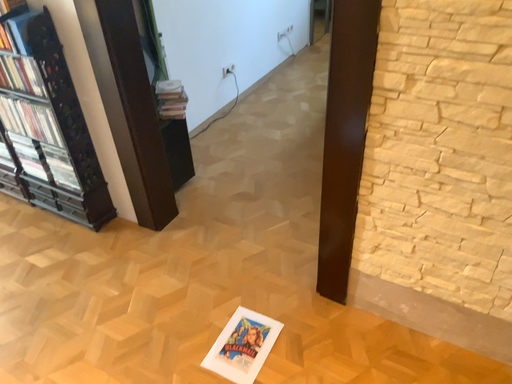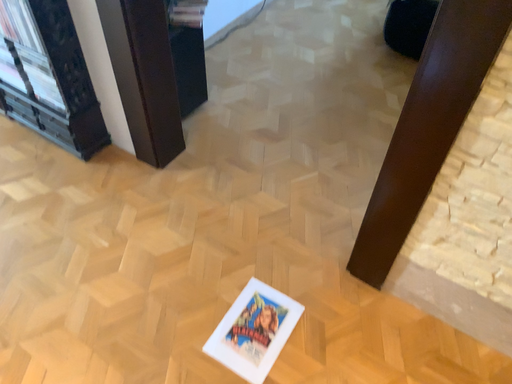
Question: Which way did the camera rotate in the video?

Choices:
 (A) rotated upward
 (B) rotated downward

Answer: (B)